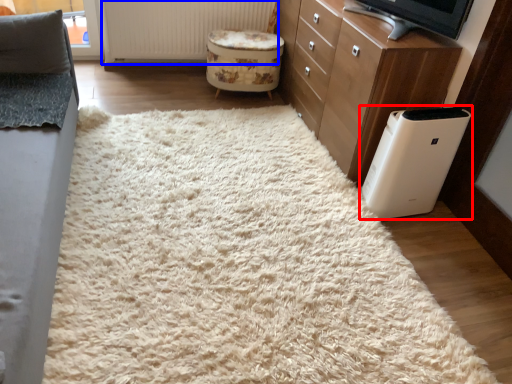
Question: Which point is further to the camera, home appliance (highlighted by a red box) or radiator (highlighted by a blue box)?

Choices:
 (A) home appliance
 (B) radiator

Answer: (B)